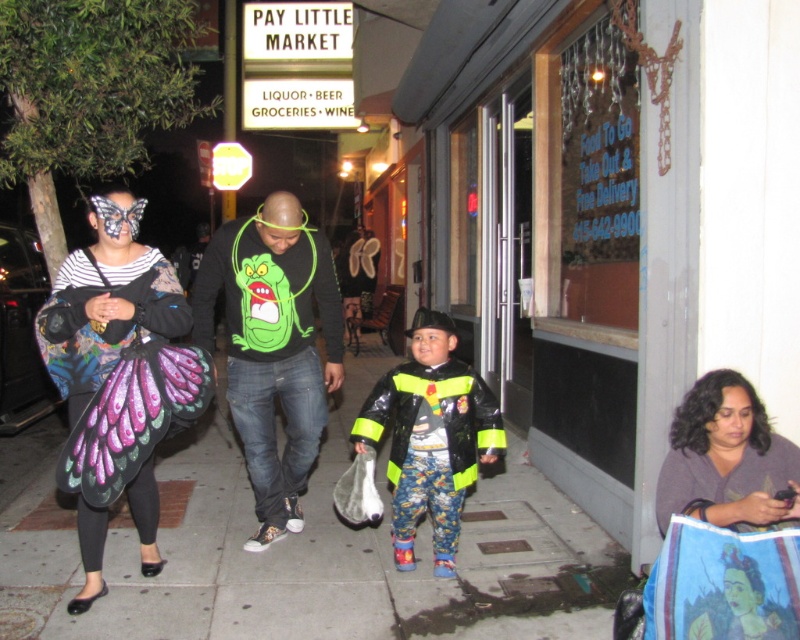
You are a photographer trying to capture a candid shot of the smooth skin face at center without including the black matte sweatshirt at center in the frame. Based on their sizes, is this possible?

The black matte sweatshirt at center is wider than the smooth skin face at center, so it might block the face if positioned closely. To capture the face without the sweatshirt, adjust the angle or zoom in to exclude the wider sweatshirt.

You are a fashion designer observing the street scene. You need to determine which clothing item is bigger in size between the black matte sweatshirt at center and the butterfly wing costume at left. Which one is larger?

The black matte sweatshirt at center is larger in size compared to the butterfly wing costume at left.